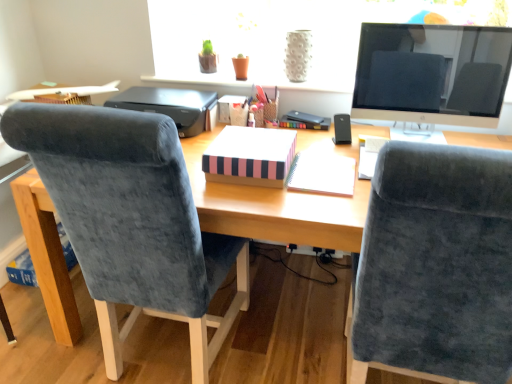
At what (x,y) coordinates should I click in order to perform the action: click on free space in front of black plastic speaker at right. Please return your answer as a coordinate pair (x, y). Looking at the image, I should click on (345, 148).